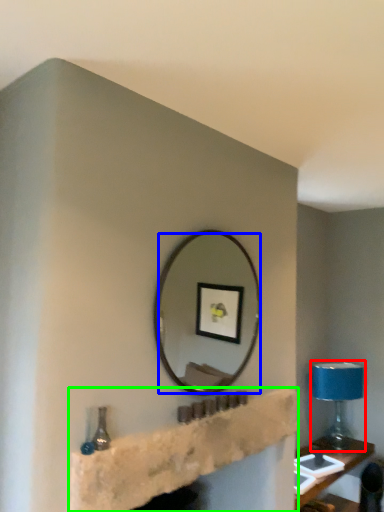
Question: Which is farther away from table lamp (highlighted by a red box)? mirror (highlighted by a blue box) or shelf (highlighted by a green box)?

Choices:
 (A) mirror
 (B) shelf

Answer: (B)